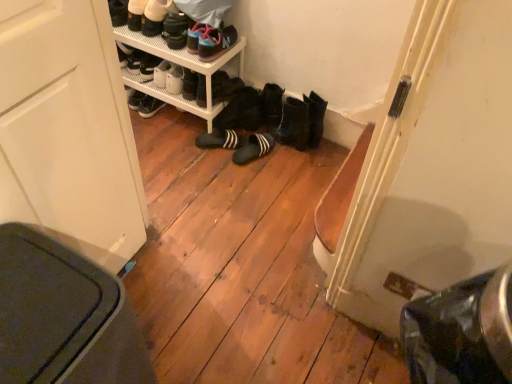
Identify the location of vacant space in black suede slippers at center, placed as the 1th footwear when sorted from bottom to top (from a real-world perspective). The image size is (512, 384). (246, 145).